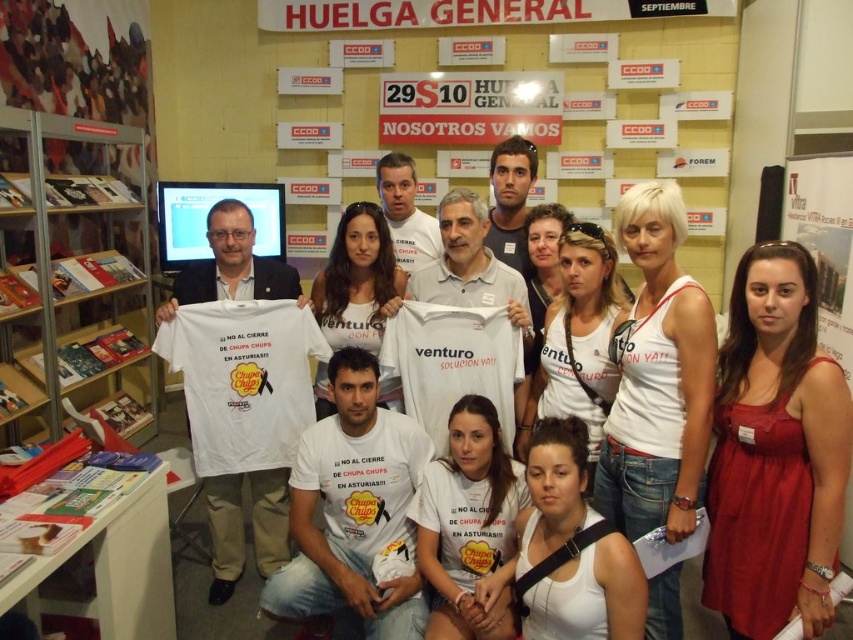
Question: Can you confirm if white cotton t-shirt at center is positioned above metallic silver bookshelf at left?

Choices:
 (A) yes
 (B) no

Answer: (B)

Question: Does red satin dress at lower right lie in front of white cotton tank top at center?

Choices:
 (A) no
 (B) yes

Answer: (B)

Question: Which is farther from the white cotton tank top at center?

Choices:
 (A) white cotton t-shirt at center
 (B) red satin dress at lower right
 (C) metallic silver bookshelf at left

Answer: (C)

Question: Among these points, which one is farthest from the camera?

Choices:
 (A) (729, 632)
 (B) (651, 627)
 (C) (263, 557)
 (D) (61, 417)

Answer: (D)

Question: Which of the following is the closest to the observer?

Choices:
 (A) (822, 598)
 (B) (645, 413)

Answer: (A)

Question: Does red satin dress at lower right lie in front of white cotton tank top at center?

Choices:
 (A) no
 (B) yes

Answer: (B)